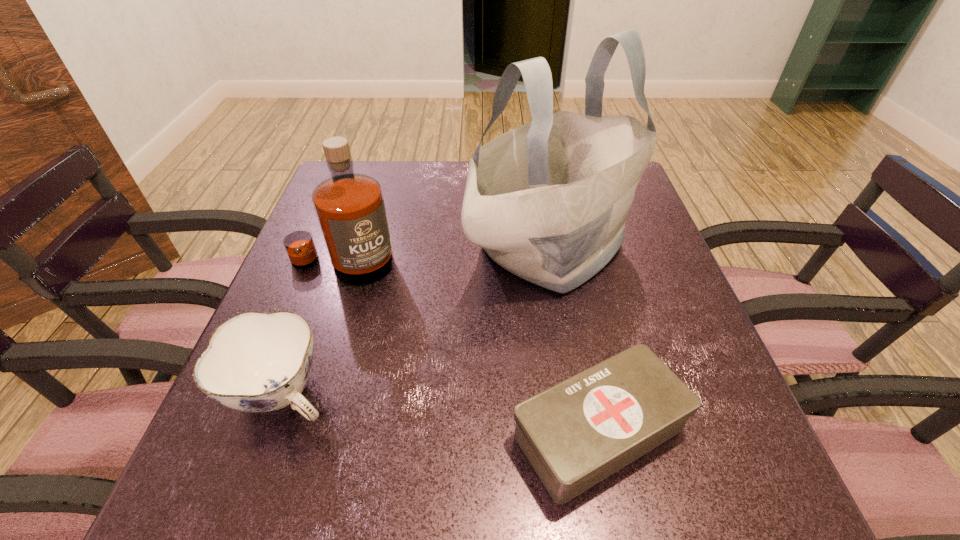
The height and width of the screenshot is (540, 960). What are the coordinates of `object that stands as the second closest to the chinaware` in the screenshot? It's located at (547, 201).

Select which object appears as the closest to the second shortest object. Please provide its 2D coordinates. Your answer should be formatted as a tuple, i.e. [(x, y)], where the tuple contains the x and y coordinates of a point satisfying the conditions above.

[(350, 208)]

Identify the location of vacant region that satisfies the following two spatial constraints: 1. on the front side of the shopping bag; 2. on the left side of the first-aid kit. Image resolution: width=960 pixels, height=540 pixels. (585, 431).

The width and height of the screenshot is (960, 540). Identify the location of blank area in the image that satisfies the following two spatial constraints: 1. on the front label of the shortest object; 2. on the left side of the liquor. (286, 431).

The width and height of the screenshot is (960, 540). Identify the location of free location that satisfies the following two spatial constraints: 1. on the front side of the tallest object; 2. on the right side of the shortest object. (585, 431).

Identify the location of vacant point that satisfies the following two spatial constraints: 1. on the front side of the chinaware; 2. on the right side of the first-aid kit. The image size is (960, 540). (271, 431).